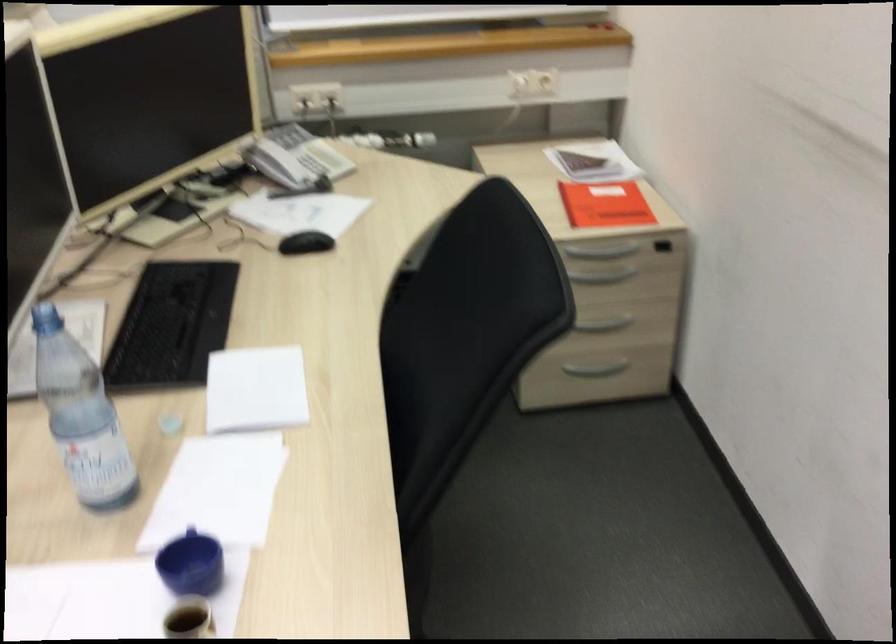
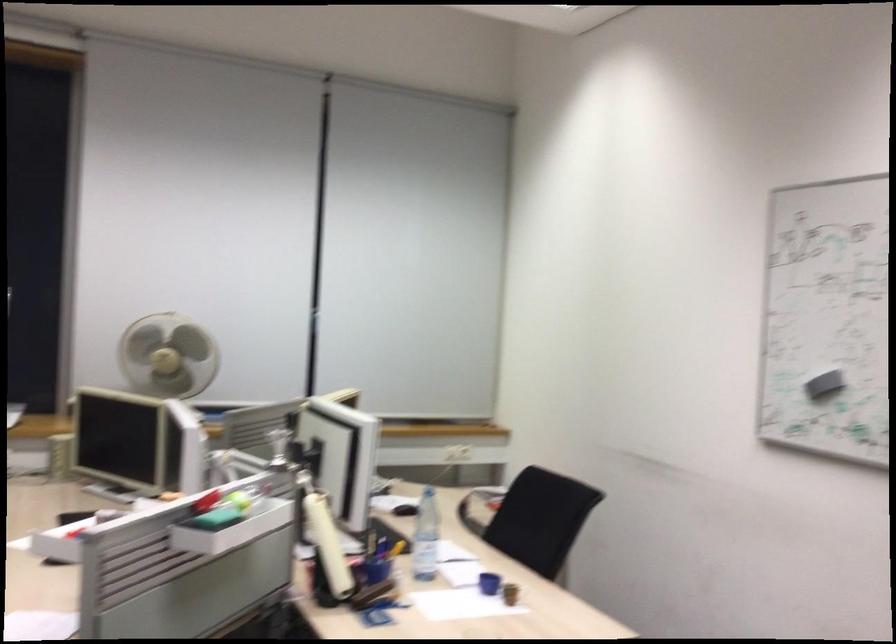
Find the pixel in the second image that matches [453,362] in the first image.

(531, 518)